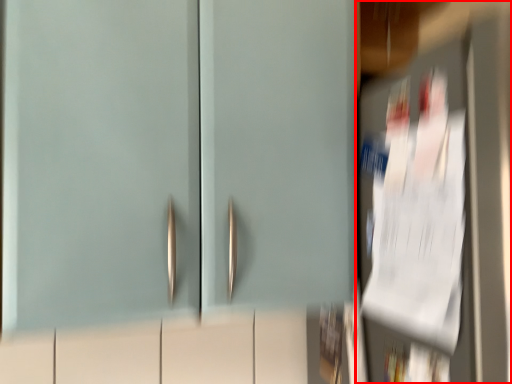
Question: Observing the image, what is the correct spatial positioning of door (annotated by the red box) in reference to door?

Choices:
 (A) left
 (B) right

Answer: (B)